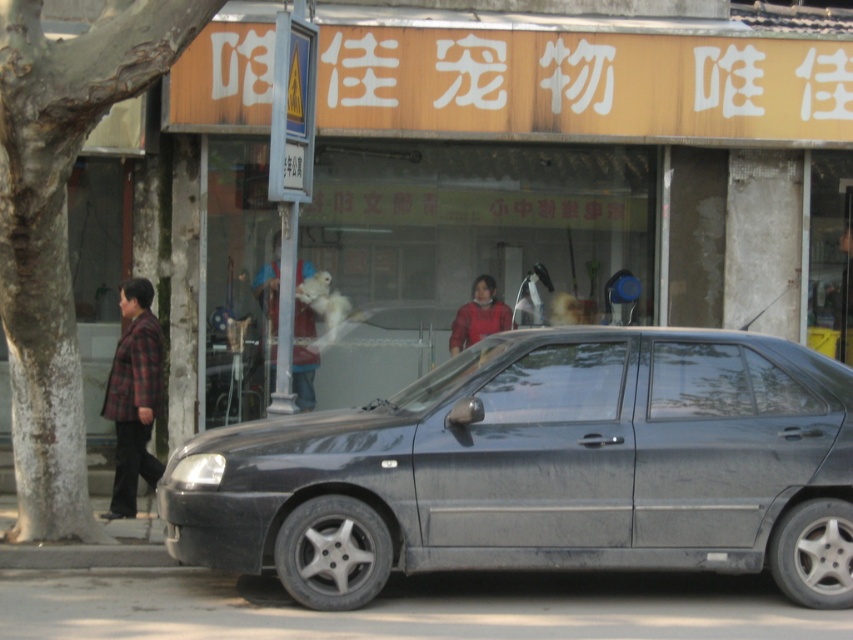
Question: Which of the following is the closest to the observer?

Choices:
 (A) (141, 461)
 (B) (224, 508)
 (C) (451, 344)

Answer: (B)

Question: Which object is farther from the camera taking this photo?

Choices:
 (A) plaid fabric jacket at left
 (B) matte gray car at center

Answer: (A)

Question: Where is matte gray car at center located in relation to plaid fabric jacket at left in the image?

Choices:
 (A) left
 (B) right

Answer: (B)

Question: Among these points, which one is farthest from the camera?

Choices:
 (A) (786, 548)
 (B) (125, 316)

Answer: (B)

Question: Is matte gray car at center smaller than plaid fabric jacket at left?

Choices:
 (A) no
 (B) yes

Answer: (A)

Question: Is plaid fabric jacket at left above red matte jacket at center?

Choices:
 (A) no
 (B) yes

Answer: (A)